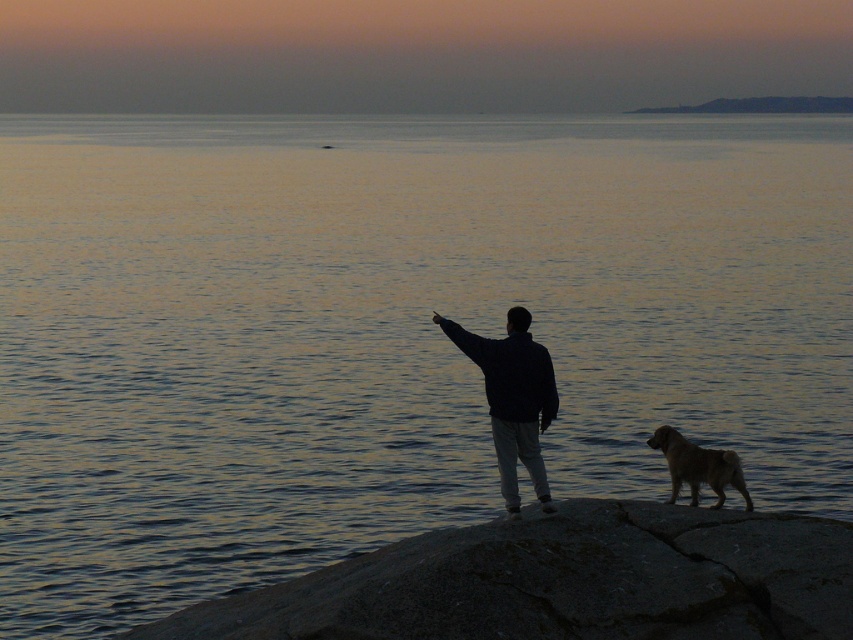
You are a painter who wants to capture the scene in the image. You notice the smooth orange sky at upper center and the gray rough rock at lower center. Which object should you paint first if you want to follow the rule of painting larger objects before smaller ones?

The smooth orange sky at upper center might be wider than gray rough rock at lower center, so you should paint the smooth orange sky at upper center first.

You are a hiker who just arrived at the rocky outcrop. You need to place a 3 feet long emergency blanket between the gray rough rock at lower center and the golden fur dog at lower right. Is there enough space to place it without folding?

The distance between the gray rough rock at lower center and the golden fur dog at lower right is 5.12 feet. Since the emergency blanket is 3 feet long, there is enough space to place it without folding.